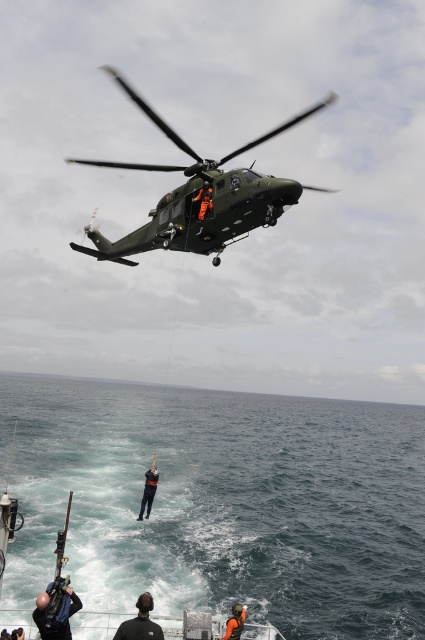
Question: Which point is closer to the camera taking this photo?

Choices:
 (A) (65, 637)
 (B) (146, 625)
 (C) (272, 179)
 (D) (164, 600)

Answer: (B)

Question: Does dark blue fabric at center have a greater width compared to orange life vest at lower center?

Choices:
 (A) no
 (B) yes

Answer: (B)

Question: Can you confirm if dark blue water at center is wider than black fabric person at lower center?

Choices:
 (A) no
 (B) yes

Answer: (B)

Question: Which of the following is the farthest from the observer?

Choices:
 (A) (212, 184)
 (B) (34, 609)
 (C) (153, 468)

Answer: (C)

Question: Which is farther from the dark blue water at center?

Choices:
 (A) orange life vest at lower center
 (B) dark blue wetsuit at lower left
 (C) black fabric person at lower center

Answer: (C)

Question: In this image, where is dark blue wetsuit at lower left located relative to orange life vest at lower center?

Choices:
 (A) above
 (B) below

Answer: (A)